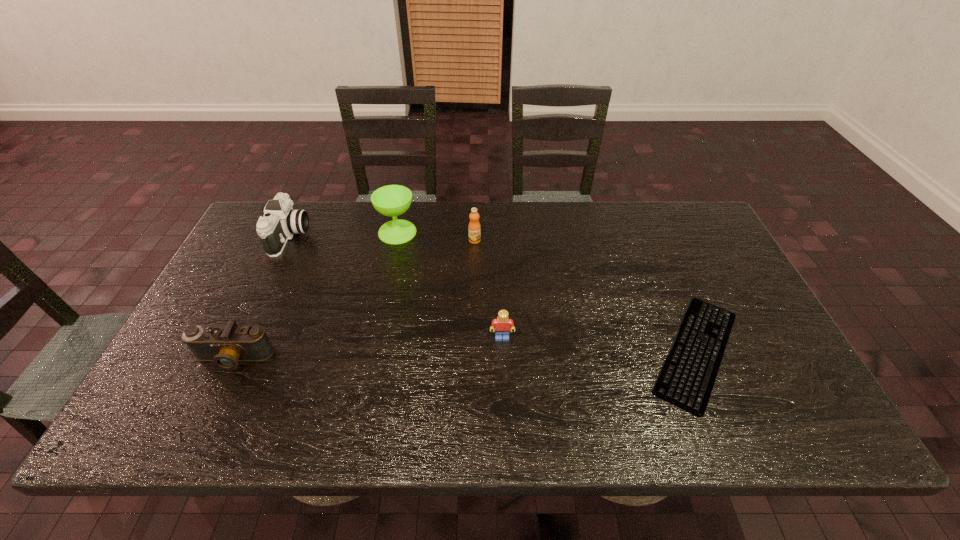
Locate an element on the screen. This screenshot has height=540, width=960. wineglass is located at coordinates (392, 200).

You are a GUI agent. You are given a task and a screenshot of the screen. Output one action in this format:
    pyautogui.click(x=<x>, y=<y>)
    Task: Click on the taller camera
    
    Given the screenshot: What is the action you would take?
    pyautogui.click(x=280, y=221)

The width and height of the screenshot is (960, 540). I want to click on the fourth object from left to right, so click(474, 228).

I want to click on the second object from right to left, so click(x=502, y=325).

At what (x,y) coordinates should I click in order to perform the action: click on the nearer camera. Please return your answer as a coordinate pair (x, y). The image size is (960, 540). Looking at the image, I should click on (225, 345).

You are a GUI agent. You are given a task and a screenshot of the screen. Output one action in this format:
    pyautogui.click(x=<x>, y=<y>)
    Task: Click on the shortest object
    This screenshot has height=540, width=960.
    Given the screenshot: What is the action you would take?
    (687, 378)

In order to click on computer keyboard in this screenshot , I will do `click(687, 378)`.

Locate an element on the screen. free space located on the right of the wineglass is located at coordinates (473, 232).

Locate an element on the screen. The width and height of the screenshot is (960, 540). vacant point located on the left of the taller camera is located at coordinates (256, 236).

Where is `vacant space located 0.060m on the front label of the orange juice`? The width and height of the screenshot is (960, 540). vacant space located 0.060m on the front label of the orange juice is located at coordinates (474, 258).